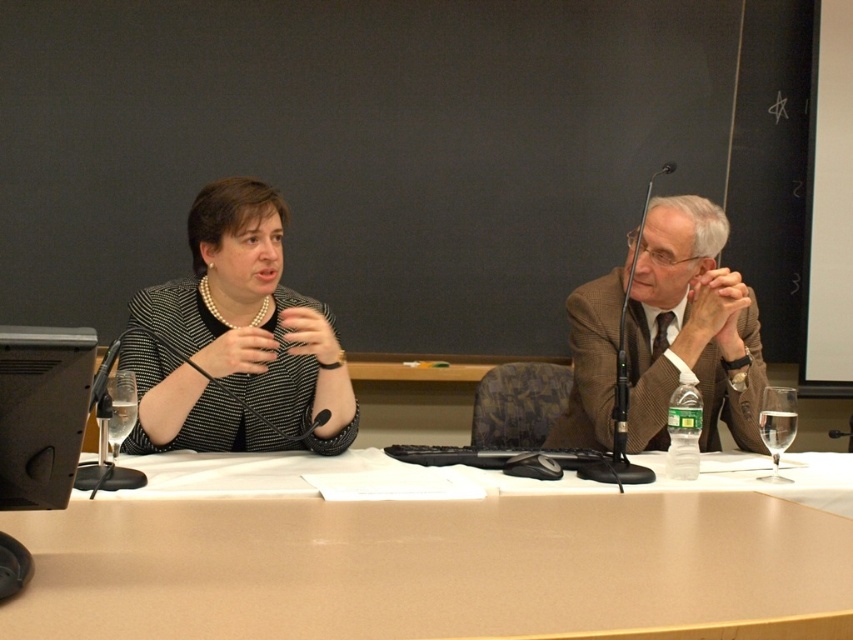
Does brown wooden table at center have a larger size compared to black textured blazer at left?

No.

How distant is brown wooden table at center from black textured blazer at left?

brown wooden table at center is 17.35 inches away from black textured blazer at left.

Between point (76, 509) and point (276, 400), which one is positioned in front?

Point (76, 509)

Identify the location of brown wooden table at center. (436, 568).

Which of these two, brown wooden table at center or brown textured suit at right, stands shorter?

With less height is brown wooden table at center.

Is point (445, 540) positioned in front of point (653, 428)?

Yes, it is in front of point (653, 428).

The width and height of the screenshot is (853, 640). What are the coordinates of `brown wooden table at center` in the screenshot? It's located at (436, 568).

Is black textured blazer at left bigger than brown textured suit at right?

No, black textured blazer at left is not bigger than brown textured suit at right.

Does black textured blazer at left have a smaller size compared to brown textured suit at right?

Yes.

Where is `black textured blazer at left`? black textured blazer at left is located at coordinates (236, 339).

Locate an element on the screen. black textured blazer at left is located at coordinates (236, 339).